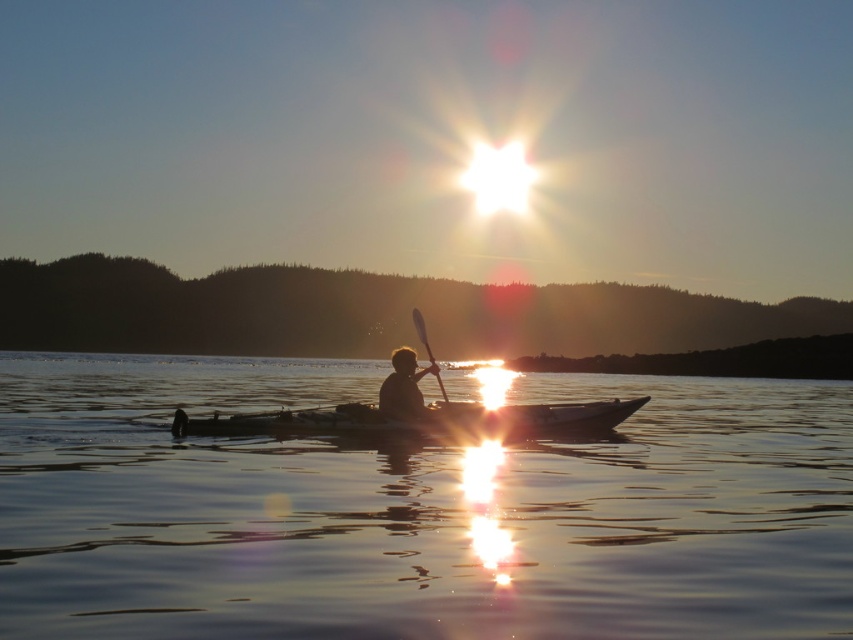
Question: Among these points, which one is farthest from the camera?

Choices:
 (A) (532, 436)
 (B) (424, 419)
 (C) (404, 605)

Answer: (A)

Question: Is transparent water at center to the right of smooth skin person at center from the viewer's perspective?

Choices:
 (A) yes
 (B) no

Answer: (A)

Question: Which is nearer to the transparent water at center?

Choices:
 (A) smooth skin person at center
 (B) wooden smooth paddle at center
 (C) matte gray kayak at center

Answer: (A)

Question: Which of the following is the closest to the observer?

Choices:
 (A) (300, 456)
 (B) (439, 426)
 (C) (416, 401)
 (D) (427, 353)

Answer: (A)

Question: Is transparent water at center smaller than matte gray kayak at center?

Choices:
 (A) no
 (B) yes

Answer: (A)

Question: Is smooth skin person at center smaller than wooden smooth paddle at center?

Choices:
 (A) no
 (B) yes

Answer: (B)